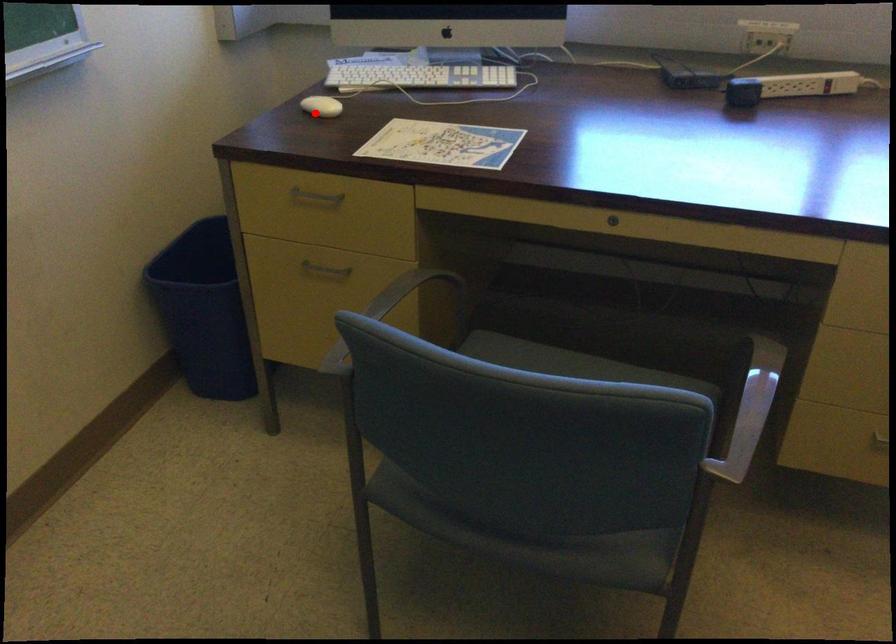
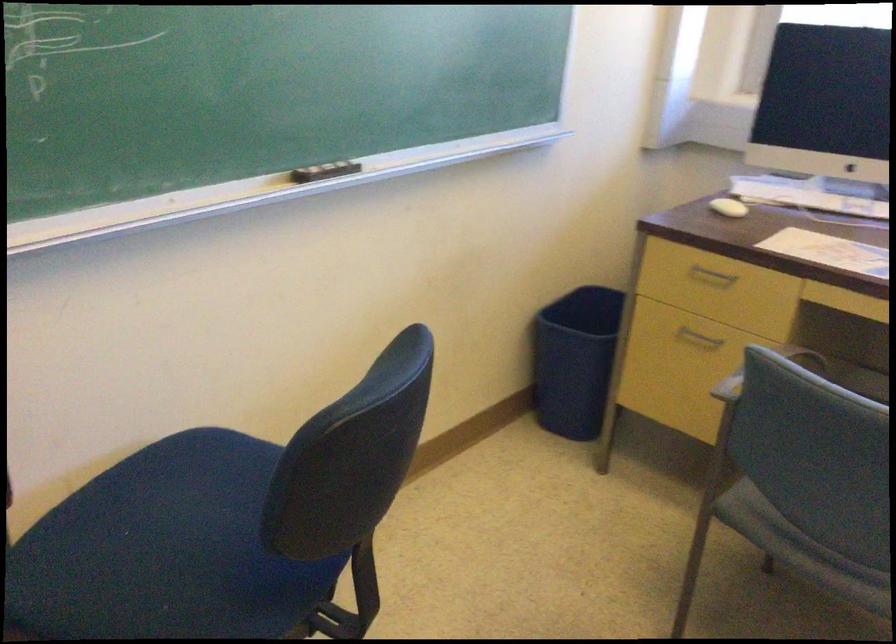
Where in the second image is the point corresponding to the highlighted location from the first image?

(728, 207)